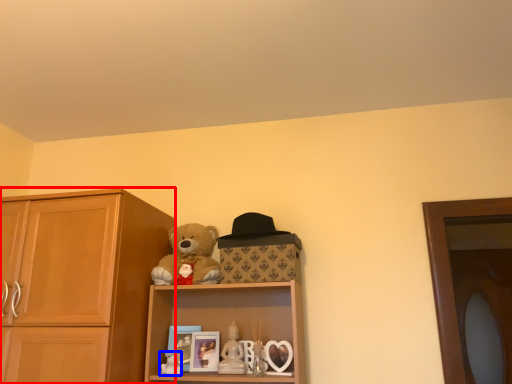
Question: Among these objects, which one is nearest to the camera, cabinetry (highlighted by a red box) or toy (highlighted by a blue box)?

Choices:
 (A) cabinetry
 (B) toy

Answer: (A)